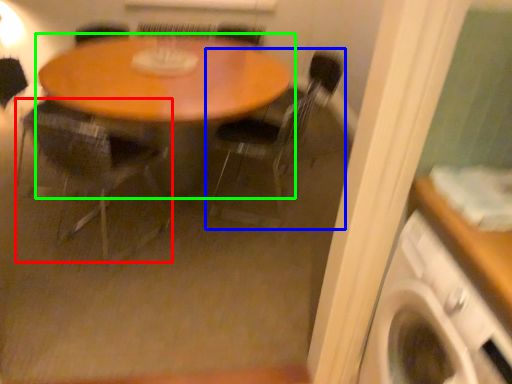
Question: Estimate the real-world distances between objects in this image. Which object is farther from chair (highlighted by a red box), chair (highlighted by a blue box) or table (highlighted by a green box)?

Choices:
 (A) chair
 (B) table

Answer: (A)